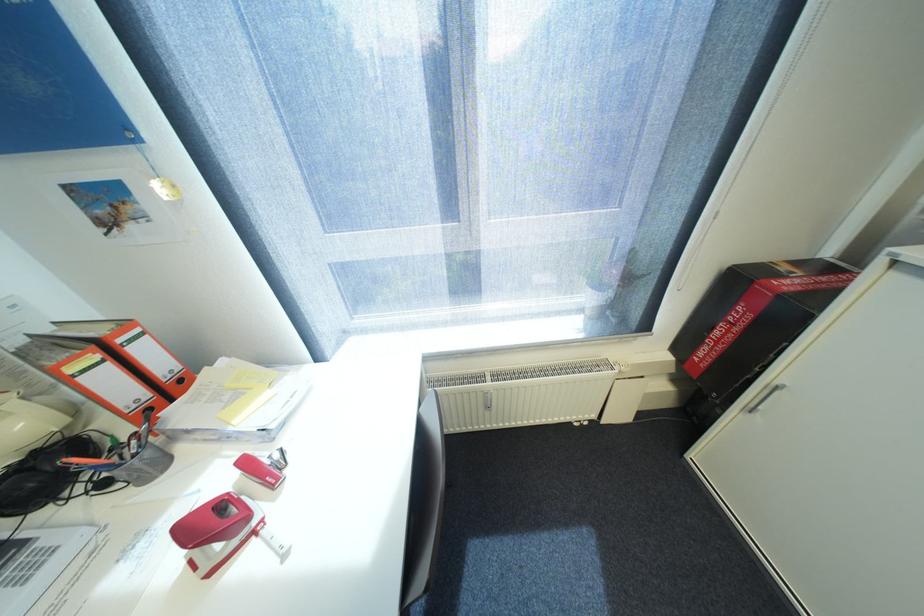
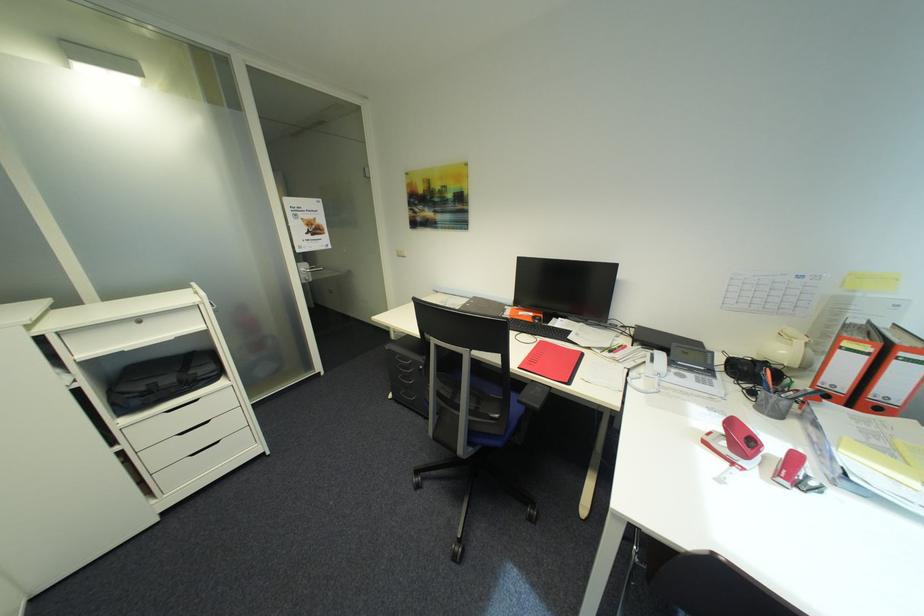
Where in the second image is the point corresponding to point (261, 533) from the first image?

(742, 464)